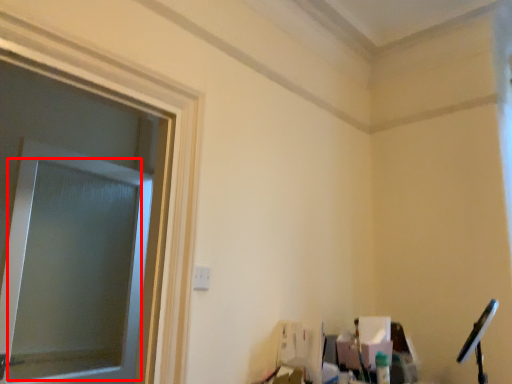
Question: In this image, where is window screen (annotated by the red box) located relative to window frame?

Choices:
 (A) left
 (B) right

Answer: (A)